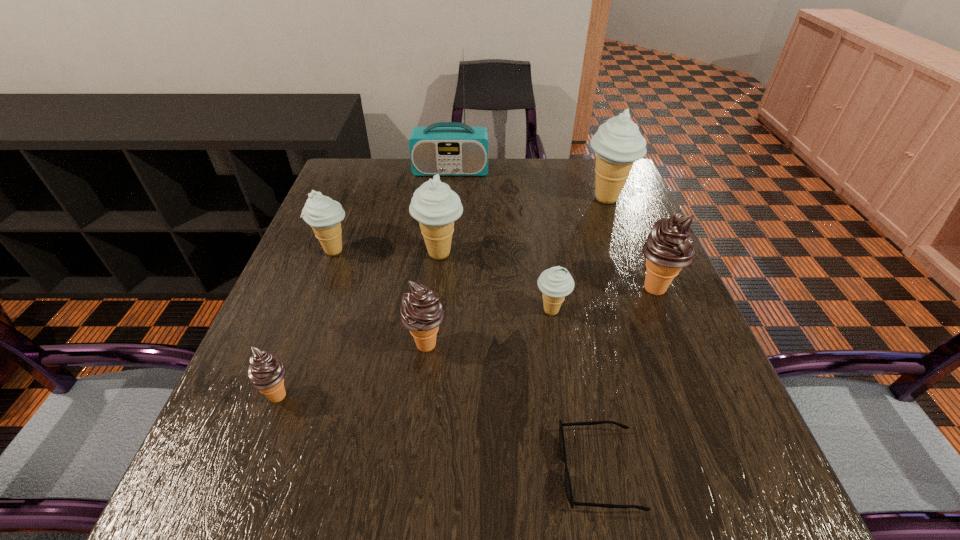
Locate an element on the screen. the tallest object is located at coordinates (446, 148).

The image size is (960, 540). Identify the location of light radio receiver. (446, 148).

The height and width of the screenshot is (540, 960). Identify the location of the eighth nearest object. 618,143.

In order to click on the farthest beige icecream in this screenshot , I will do `click(618, 143)`.

Find the location of a particular element. This screenshot has height=540, width=960. the farthest chocolate icecream is located at coordinates (668, 248).

The image size is (960, 540). Identify the location of the rightmost chocolate icecream. (668, 248).

This screenshot has width=960, height=540. I want to click on the second beige icecream from left to right, so click(434, 205).

Locate an element on the screen. the leftmost beige icecream is located at coordinates (324, 215).

You are a GUI agent. You are given a task and a screenshot of the screen. Output one action in this format:
    pyautogui.click(x=<x>, y=<y>)
    Task: Click on the third nearest object
    The image size is (960, 540).
    Given the screenshot: What is the action you would take?
    pyautogui.click(x=421, y=312)

Find the location of a particular element. the sixth farthest icecream is located at coordinates (421, 312).